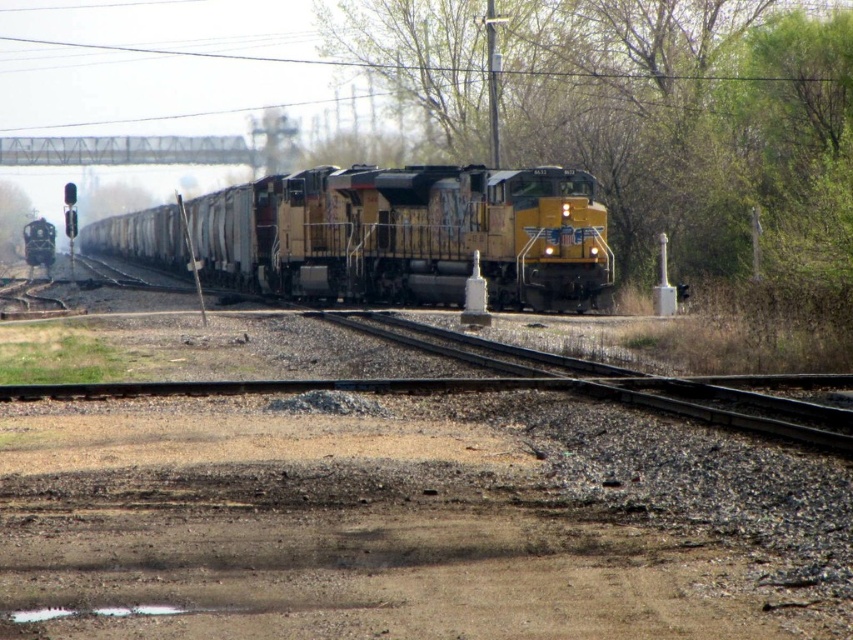
You are a photographer standing at the edge of the railway. You want to capture both the yellow weathered locomotive at center and the green leafy tree at left in your shot. Which object should you frame first to ensure both fit in the photo?

The yellow weathered locomotive at center is wider than the green leafy tree at left, so you should frame the yellow weathered locomotive at center first to ensure both fit in the photo.

You are a passenger on the yellow weathered locomotive at center and want to look out the window to see the green leafy tree at left. Can you see it from your current position?

The yellow weathered locomotive at center is in front of the green leafy tree at left, so the locomotive is blocking your view of the tree. You cannot see the green leafy tree at left from your current position.